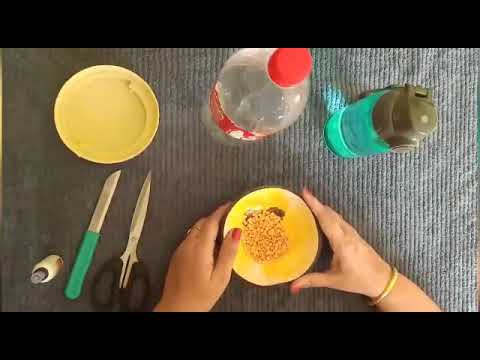
The image size is (480, 360). I want to click on bottle, so click(49, 272).